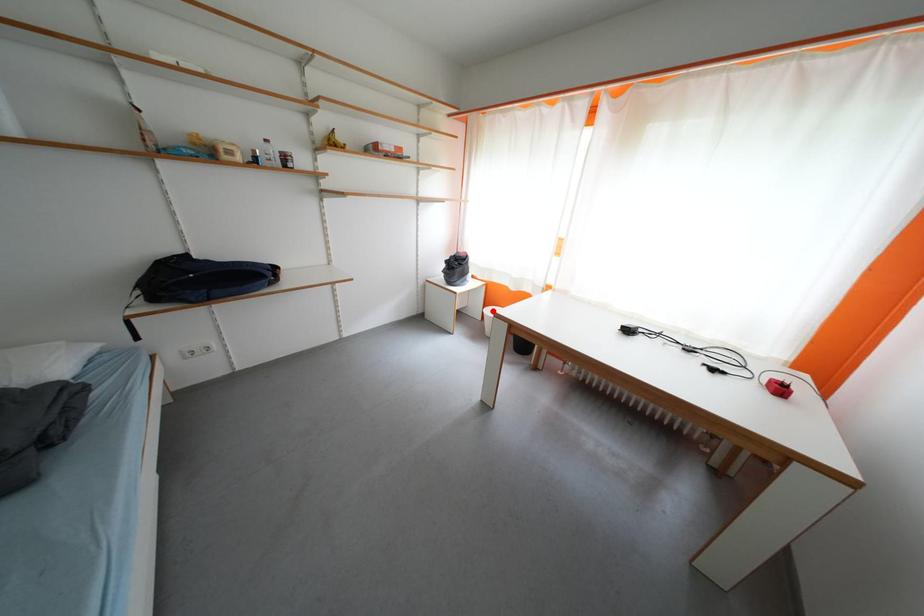
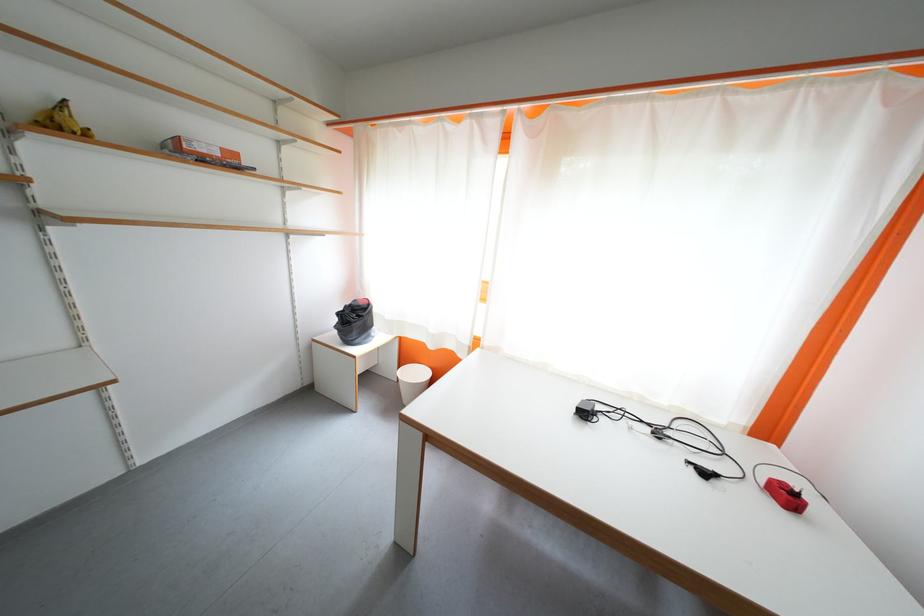
Question: I am providing you with two images of the same scene from different viewpoints. A red point is shown in image1. For the corresponding object point in image2, is it positioned nearer or farther from the camera?

Choices:
 (A) Nearer
 (B) Farther

Answer: (B)